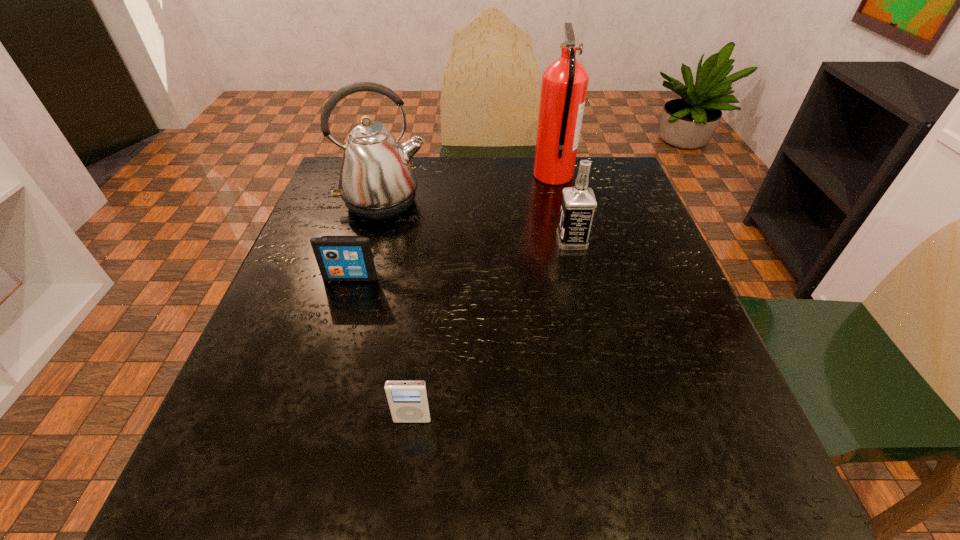
Locate an element on the screen. This screenshot has width=960, height=540. iPod located at the left edge is located at coordinates (340, 258).

I want to click on object that is at the right edge, so click(x=564, y=85).

Where is `object that is at the far left corner`? object that is at the far left corner is located at coordinates (376, 182).

The width and height of the screenshot is (960, 540). Identify the location of object that is at the far right corner. (564, 85).

What are the coordinates of `vacant space at the far edge` in the screenshot? It's located at click(416, 196).

Identify the location of free space at the near edge of the desktop. This screenshot has height=540, width=960. (553, 497).

At what (x,y) coordinates should I click in order to perform the action: click on vacant space at the left edge of the desktop. Please return your answer as a coordinate pair (x, y). The height and width of the screenshot is (540, 960). Looking at the image, I should click on (361, 233).

Find the location of a particular element. free space at the right edge of the desktop is located at coordinates (620, 277).

Image resolution: width=960 pixels, height=540 pixels. Identify the location of vacant region at the near left corner of the desktop. (183, 496).

In the image, there is a desktop. Identify the location of vacant space at the near right corner. The width and height of the screenshot is (960, 540). (712, 503).